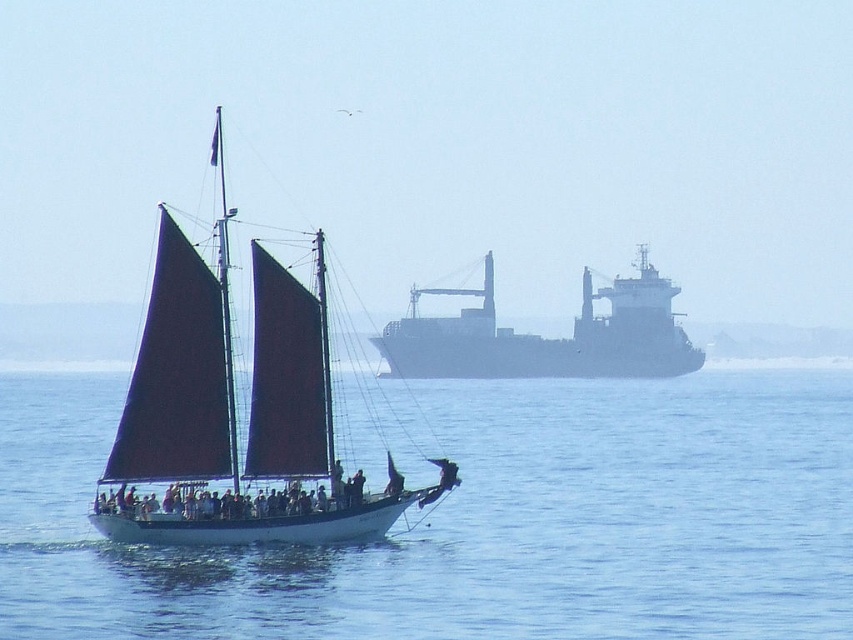
Between matte red sails at center and white matte sailboat at center, which one has more height?

matte red sails at center

Looking at this image, does matte red sails at center appear under white matte sailboat at center?

Actually, matte red sails at center is above white matte sailboat at center.

Is point (187, 305) behind point (200, 506)?

Yes, it is behind point (200, 506).

The height and width of the screenshot is (640, 853). In order to click on matte red sails at center in this screenshot , I will do `click(234, 410)`.

Is dark gray metallic cargo ship at upper center to the left of white matte sailboat at center from the viewer's perspective?

No, dark gray metallic cargo ship at upper center is not to the left of white matte sailboat at center.

Is dark gray metallic cargo ship at upper center thinner than white matte sailboat at center?

Incorrect, dark gray metallic cargo ship at upper center's width is not less than white matte sailboat at center's.

Find the location of `dark gray metallic cargo ship at upper center`. dark gray metallic cargo ship at upper center is located at coordinates (546, 339).

Which is in front, point (144, 340) or point (393, 321)?

Point (144, 340) is in front.

Which of these two, matte red sails at center or dark gray metallic cargo ship at upper center, stands taller?

Standing taller between the two is matte red sails at center.

Where is `matte red sails at center`? matte red sails at center is located at coordinates (234, 410).